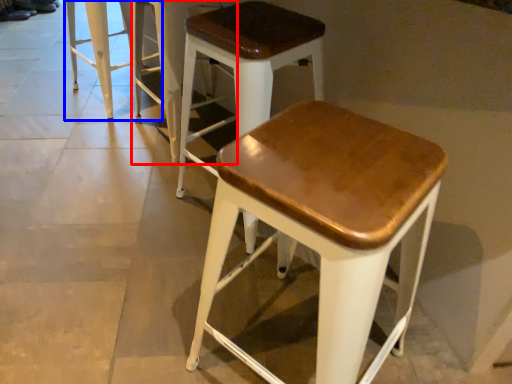
Question: Among these objects, which one is farthest to the camera, stool (highlighted by a red box) or stool (highlighted by a blue box)?

Choices:
 (A) stool
 (B) stool

Answer: (B)